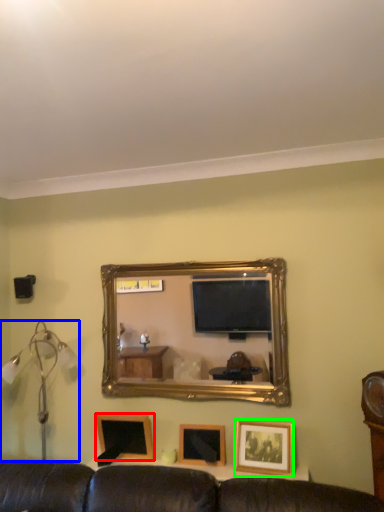
Question: Estimate the real-world distances between objects in this image. Which object is farther from picture frame (highlighted by a red box), table lamp (highlighted by a blue box) or picture frame (highlighted by a green box)?

Choices:
 (A) table lamp
 (B) picture frame

Answer: (B)